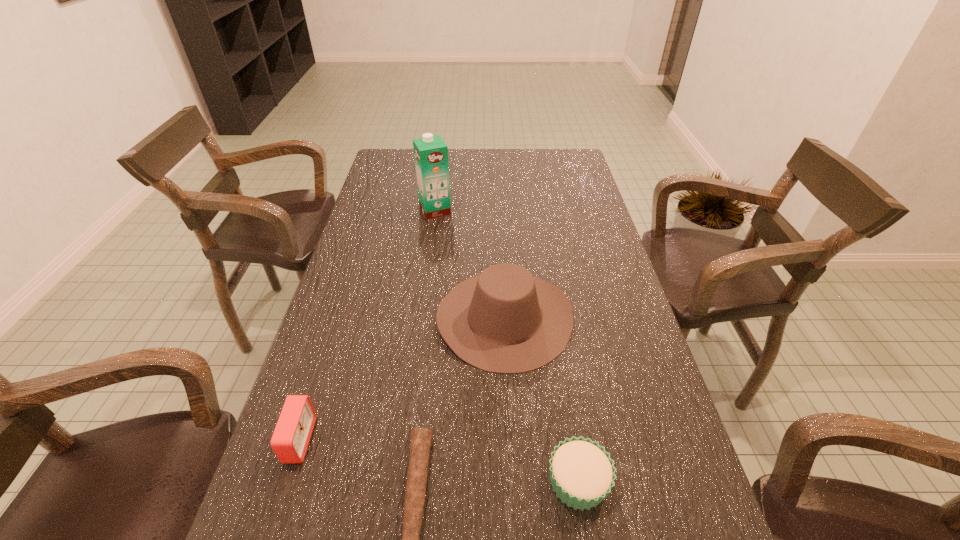
Find the location of `carton`. carton is located at coordinates (430, 152).

In order to click on the tallest object in this screenshot , I will do `click(430, 152)`.

The image size is (960, 540). I want to click on the fourth nearest object, so click(504, 320).

What are the coordinates of `the fourth shortest object` in the screenshot? It's located at (504, 320).

What are the coordinates of `alarm clock` in the screenshot? It's located at click(x=290, y=440).

Where is `the third tallest object`? the third tallest object is located at coordinates tap(290, 440).

You are a GUI agent. You are given a task and a screenshot of the screen. Output one action in this format:
    pyautogui.click(x=<x>, y=<y>)
    Task: Click on the second shortest object
    
    Given the screenshot: What is the action you would take?
    pyautogui.click(x=582, y=474)

At what (x,y) coordinates should I click in order to perform the action: click on vacant space located 0.400m on the front of the farthest object. Please return your answer as a coordinate pair (x, y). This screenshot has height=540, width=960. Looking at the image, I should click on (422, 306).

The image size is (960, 540). I want to click on free space located 0.310m on the back of the second tallest object, so click(x=498, y=213).

Locate an element on the screen. The height and width of the screenshot is (540, 960). vacant space located 0.080m on the front-facing side of the third tallest object is located at coordinates (350, 440).